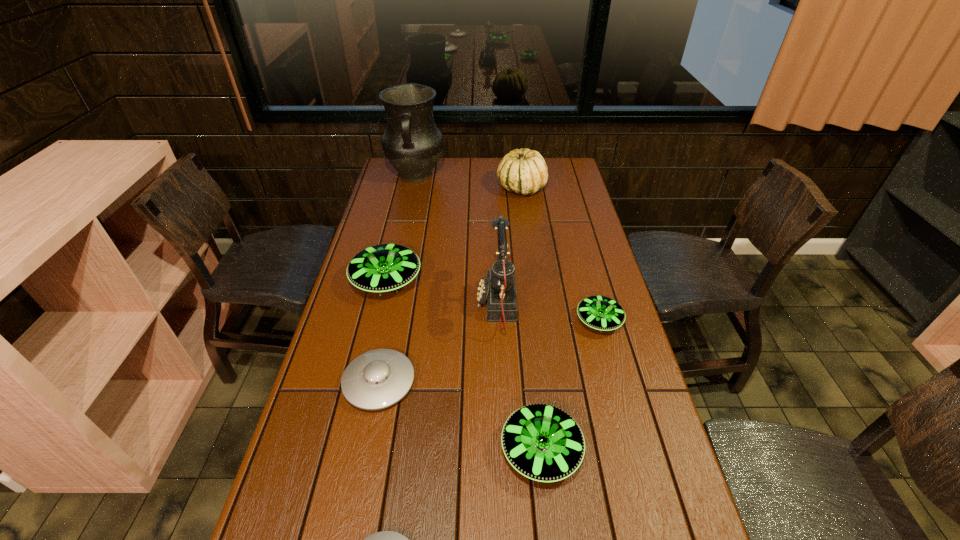
Locate an element on the screen. This screenshot has width=960, height=540. the rightmost saucer is located at coordinates (602, 313).

Locate an element on the screen. the rightmost object is located at coordinates (602, 313).

The image size is (960, 540). What are the coordinates of `the third farthest saucer` in the screenshot? It's located at (377, 379).

The height and width of the screenshot is (540, 960). In order to click on the sixth farthest object in this screenshot , I will do `click(377, 379)`.

In order to click on free region located on the handle side of the tallest object in this screenshot , I will do `click(406, 222)`.

At what (x,y) coordinates should I click in order to perform the action: click on free location located on the dial of the seventh shortest object. Please return your answer as a coordinate pair (x, y). This screenshot has height=540, width=960. Looking at the image, I should click on coord(400,305).

Find the location of `vacant space located on the dial of the seventh shortest object`. vacant space located on the dial of the seventh shortest object is located at coordinates (377, 305).

Find the location of a particular element. vacant space located on the dial of the seventh shortest object is located at coordinates (391, 305).

Identify the location of free space located 0.360m on the front of the white gourd. (531, 259).

The height and width of the screenshot is (540, 960). I want to click on free space located on the back of the biggest green saucer, so click(x=396, y=238).